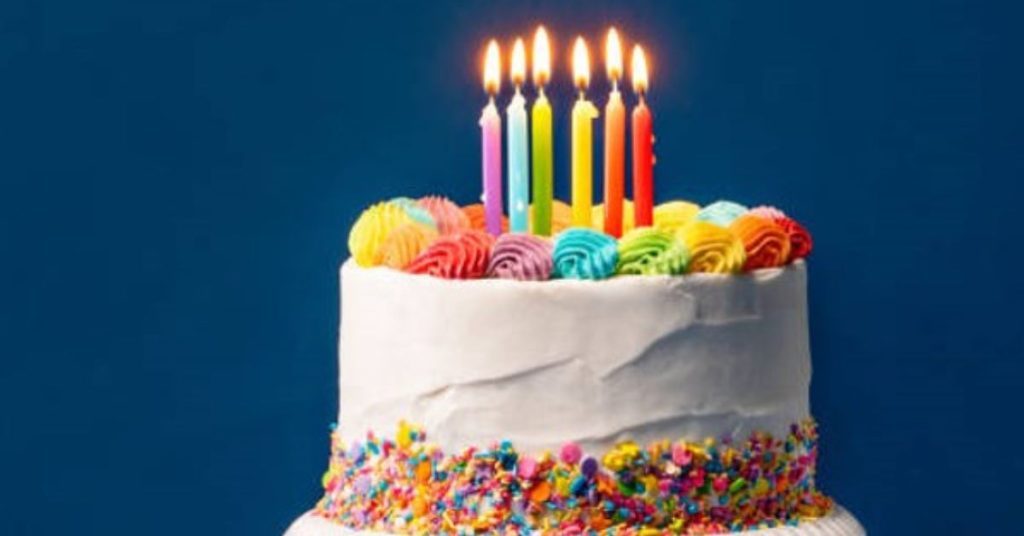
I want to click on birthday candles, so click(x=489, y=159), click(x=513, y=155), click(x=541, y=152), click(x=583, y=147), click(x=615, y=145), click(x=644, y=141).